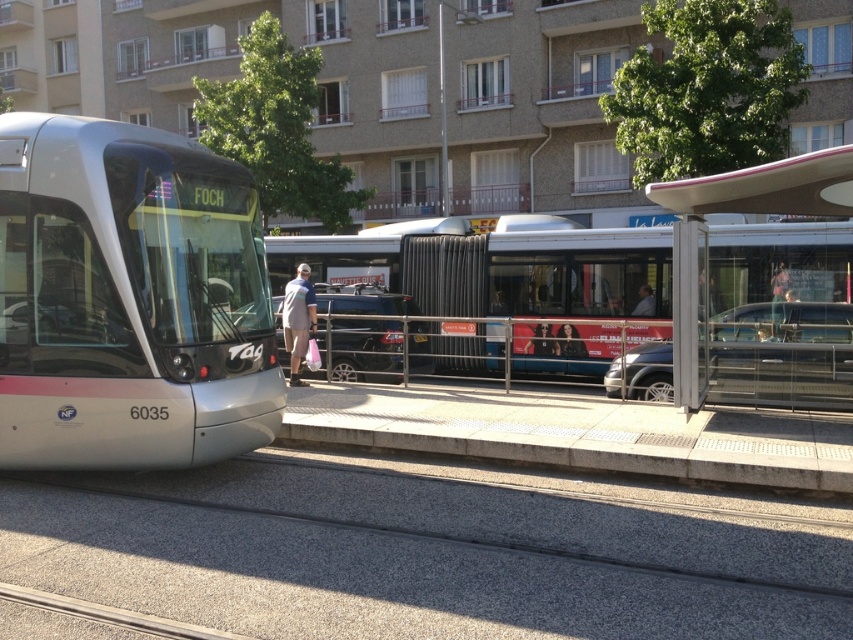
You are a photographer trying to capture a portrait of a person standing at the tram stop. The person has dark brown hair at center and is wearing a light brown leather jacket at center. Based on their appearance, which part of their body is wider when viewed from the front?

The dark brown hair at center is wider than the light brown leather jacket at center.